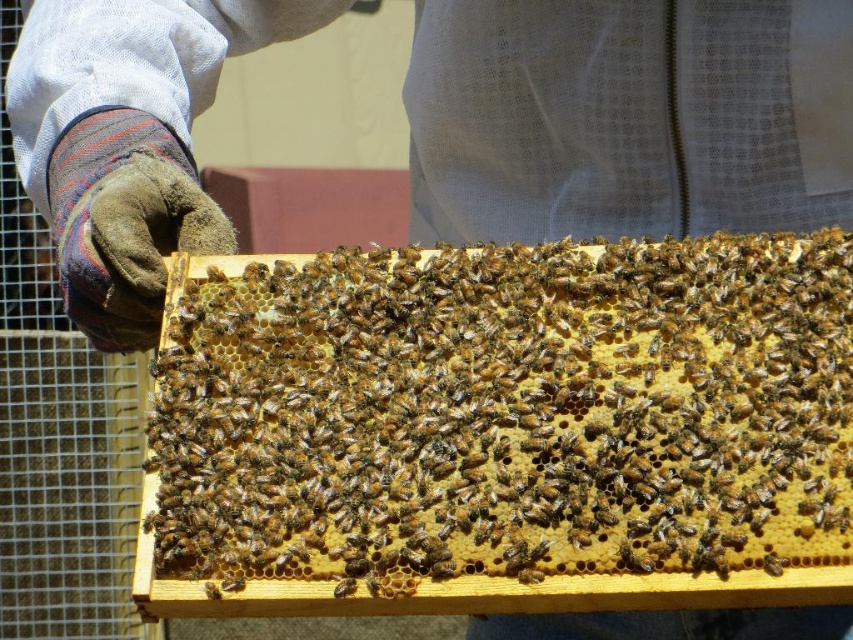
Does brown wooden beehive at center have a greater height compared to brown fuzzy bee at center?

Indeed, brown wooden beehive at center has a greater height compared to brown fuzzy bee at center.

Is brown wooden beehive at center closer to camera compared to brown fuzzy bee at center?

Yes, brown wooden beehive at center is closer to the viewer.

Who is more forward, (x=258, y=372) or (x=352, y=579)?

Point (x=352, y=579) is more forward.

This screenshot has width=853, height=640. What are the coordinates of `brown wooden beehive at center` in the screenshot? It's located at (502, 429).

Between brown wooden beehive at center and white mesh suit at center, which one is positioned higher?

white mesh suit at center is higher up.

Between brown wooden beehive at center and white mesh suit at center, which one has less height?

brown wooden beehive at center is shorter.

Does point (601, 316) come in front of point (434, 16)?

Yes, it is in front of point (434, 16).

Where is `brown wooden beehive at center`? This screenshot has height=640, width=853. brown wooden beehive at center is located at coordinates (502, 429).

Is point (689, 204) farther from camera compared to point (339, 589)?

That is True.

Consider the image. Is white mesh suit at center taller than brown fuzzy bee at center?

Correct, white mesh suit at center is much taller as brown fuzzy bee at center.

Is point (161, 13) behind point (344, 579)?

Yes, it is behind point (344, 579).

Identify the location of white mesh suit at center. (627, 116).